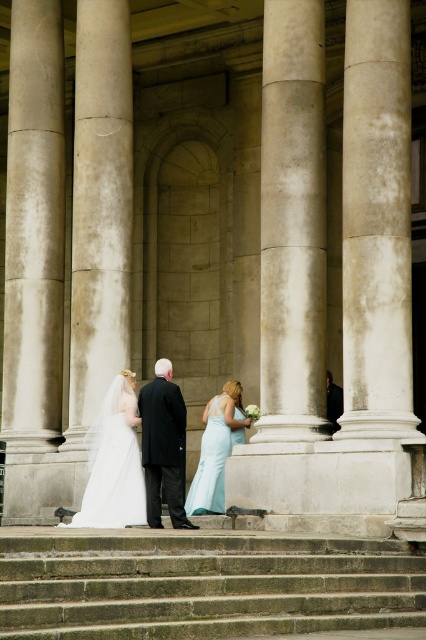
You are a photographer setting up a wide shot of the wedding scene. You need to ensure both the stone steps at center and the white satin dress at lower left are fully visible in the frame. Given their sizes, which object requires more horizontal space in the composition?

The stone steps at center require more horizontal space in the composition because their width surpasses that of the white satin dress at lower left.

Looking at this image, you are a photographer at the wedding and want to capture a photo of the white satin dress at center and the light blue satin dress at center. Which dress is lower in the image?

The white satin dress at center is positioned under the light blue satin dress at center, so the white satin dress at center is lower in the image.

You are standing at the base of the stone steps in the wedding scene. You notice two points marked on the steps. The first point is at coordinate (x=108, y=625), and the second is at (x=137, y=440). If you want to walk towards the entrance, which point should you step on first?

You should step on point (x=108, y=625) first because it is in front of point (x=137, y=440), meaning it is closer to the entrance when moving upwards the steps.